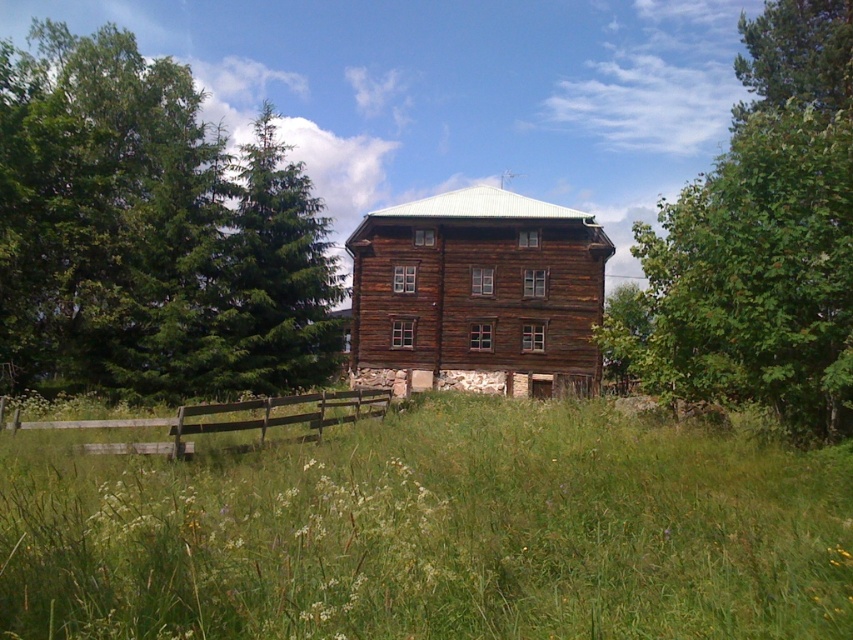
You are a delivery drone with a maximum flight range of 20 meters. You need to deliver a package from the green textured pine tree at upper left to the wooden at center. Can you complete the delivery without needing to recharge?

The distance between the green textured pine tree at upper left and wooden at center is 17.11 meters, which is within your 20 meter range. Yes, you can complete the delivery without needing to recharge.